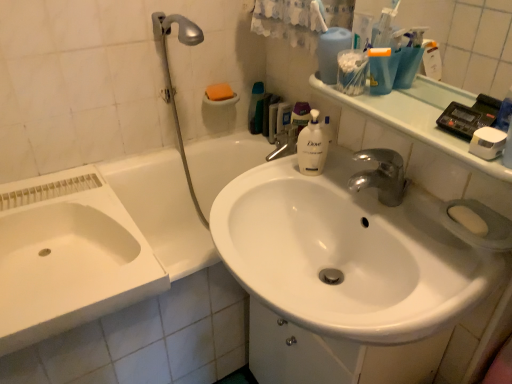
The width and height of the screenshot is (512, 384). In order to click on free spot in front of clear plastic container at upper right in this screenshot , I will do `click(391, 114)`.